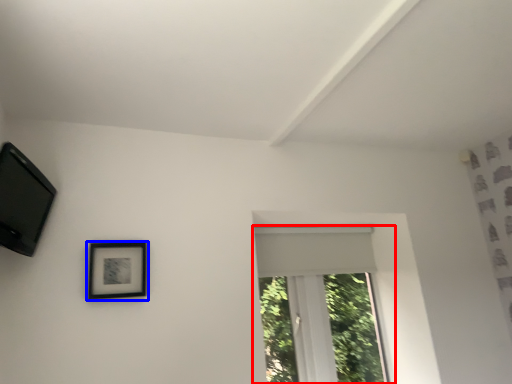
Question: Which point is closer to the camera, window (highlighted by a red box) or picture frame (highlighted by a blue box)?

Choices:
 (A) window
 (B) picture frame

Answer: (B)